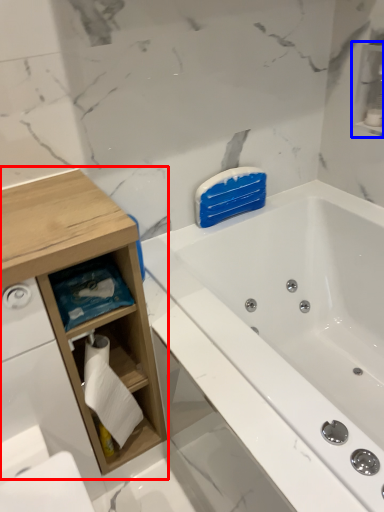
Question: Which object appears closest to the camera in this image, cabinetry (highlighted by a red box) or cabinet (highlighted by a blue box)?

Choices:
 (A) cabinetry
 (B) cabinet

Answer: (A)